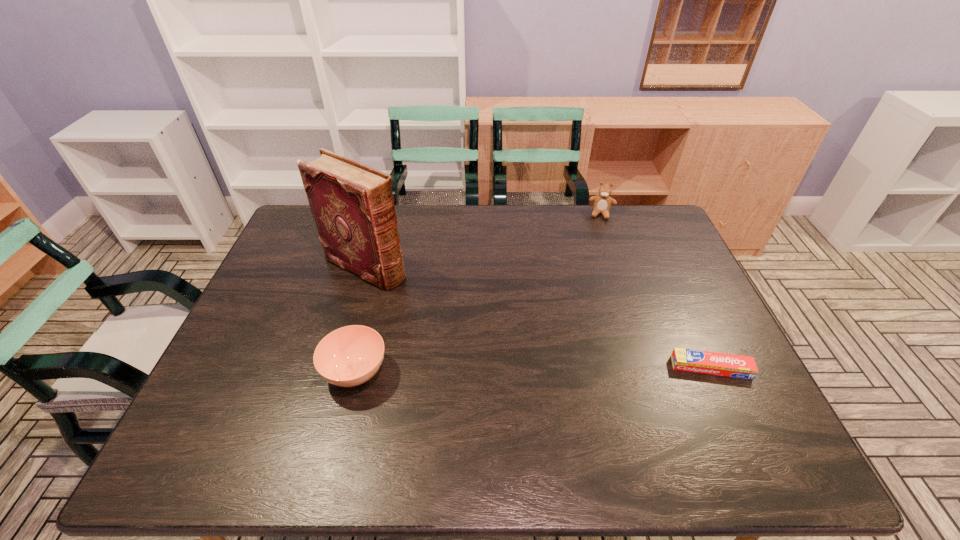
Find the location of a particular element. vacant space at the far edge of the desktop is located at coordinates (427, 237).

Locate an element on the screen. vacant area at the near edge is located at coordinates (589, 401).

The width and height of the screenshot is (960, 540). In the image, there is a desktop. Identify the location of blank space at the left edge. (289, 274).

In the image, there is a desktop. Identify the location of vacant space at the right edge. This screenshot has height=540, width=960. (704, 340).

I want to click on free region at the far right corner of the desktop, so click(661, 224).

Locate an element on the screen. The width and height of the screenshot is (960, 540). free spot between the toothpaste and the second tallest object is located at coordinates (657, 291).

Identify the location of vacant space that's between the shortest object and the hardback book. (539, 317).

This screenshot has width=960, height=540. In order to click on empty space that is in between the teddy bear and the soup bowl in this screenshot , I will do `click(479, 293)`.

Where is `free space between the shortest object and the hardback book`? free space between the shortest object and the hardback book is located at coordinates (539, 317).

The width and height of the screenshot is (960, 540). In order to click on vacant area between the shortest object and the hardback book in this screenshot , I will do `click(539, 317)`.